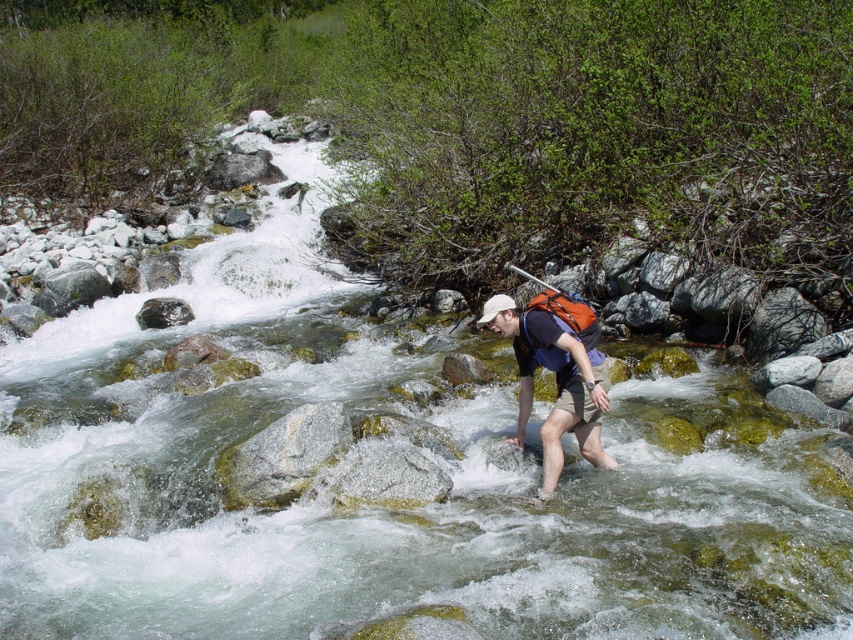
Question: Is matte black backpack at center smaller than orange fabric paddle at center?

Choices:
 (A) yes
 (B) no

Answer: (B)

Question: Does matte black backpack at center have a greater width compared to orange fabric paddle at center?

Choices:
 (A) yes
 (B) no

Answer: (A)

Question: Among these objects, which one is farthest from the camera?

Choices:
 (A) matte black backpack at center
 (B) orange fabric paddle at center

Answer: (B)

Question: Is matte black backpack at center wider than orange fabric paddle at center?

Choices:
 (A) yes
 (B) no

Answer: (A)

Question: Which point is closer to the camera?

Choices:
 (A) matte black backpack at center
 (B) orange fabric paddle at center

Answer: (A)